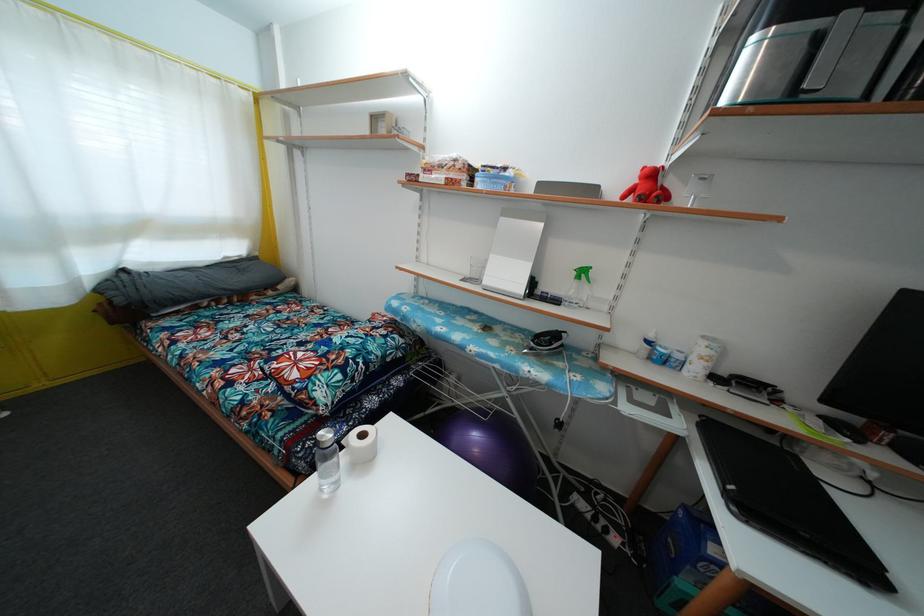
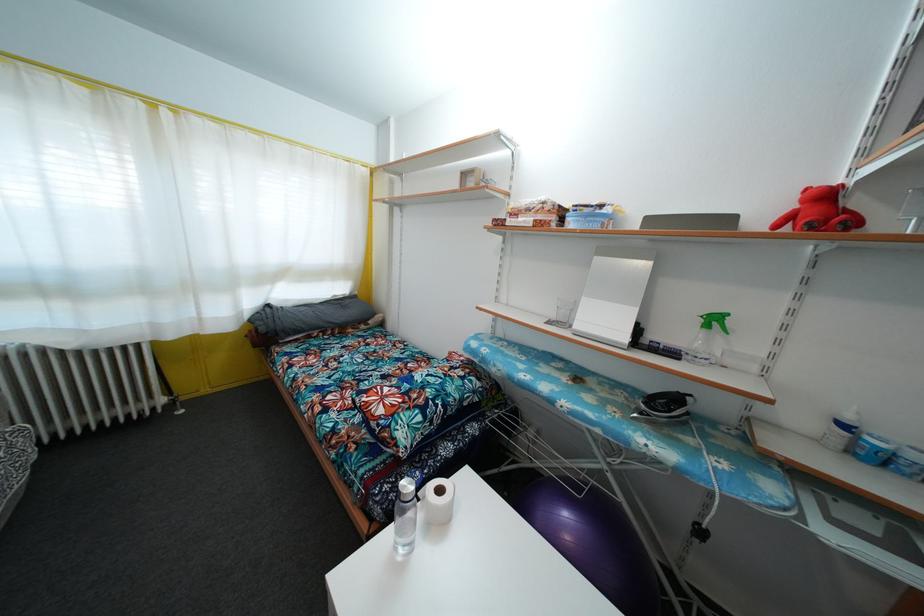
Where in the second image is the point corresponding to pixel 651 349 from the first image?

(848, 432)